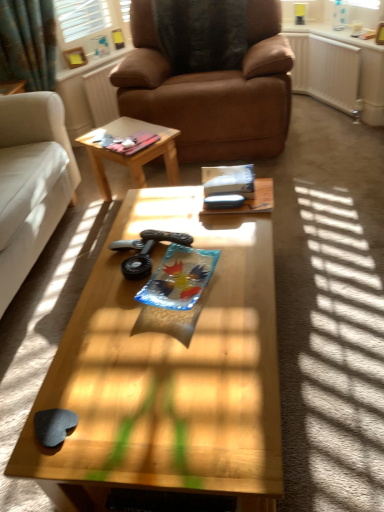
Locate an element on the screen. free space above wooden at center, acting as the second coffee table starting from the bottom (from a real-world perspective) is located at coordinates (130, 134).